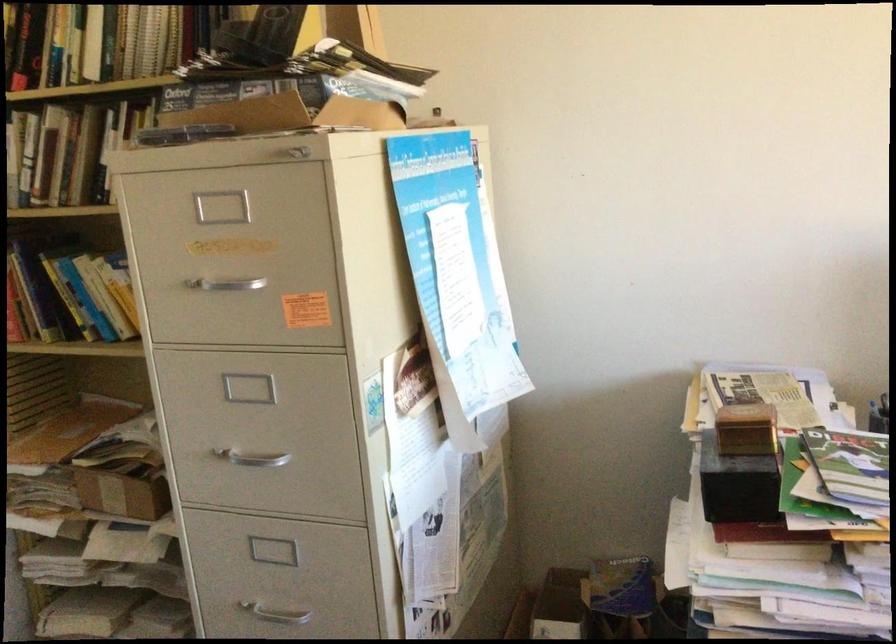
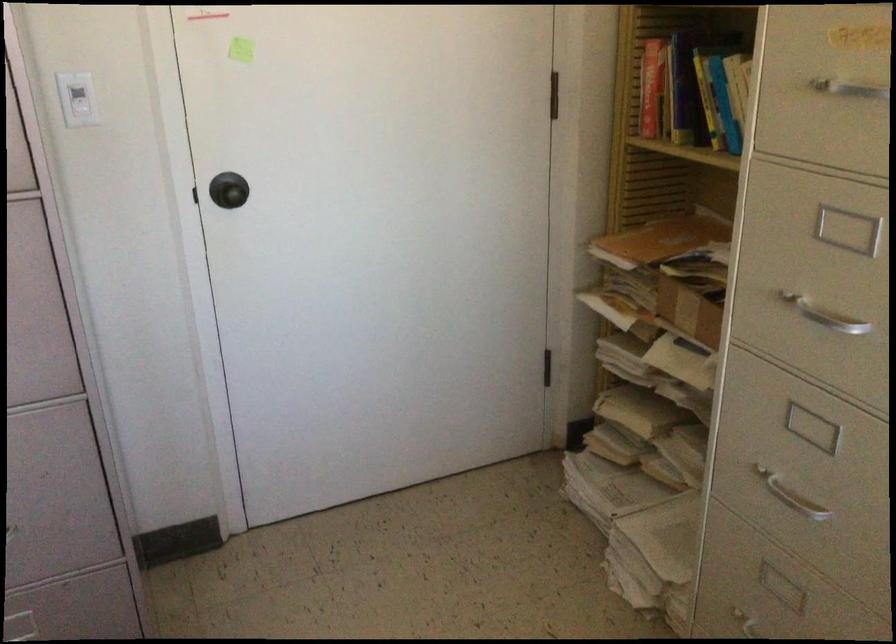
The point at (204, 276) is marked in the first image. Where is the corresponding point in the second image?

(839, 82)